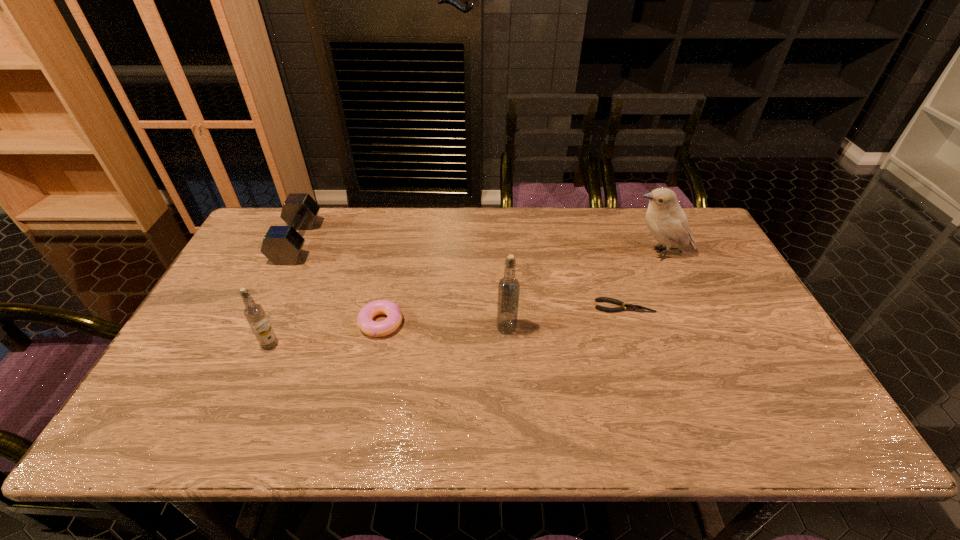
The image size is (960, 540). I want to click on free space located 0.310m on the label of the right vodka, so click(x=633, y=327).

Find the location of `free region located on the front of the dumbbell`. free region located on the front of the dumbbell is located at coordinates (247, 346).

Image resolution: width=960 pixels, height=540 pixels. Find the location of `free point located on the left of the doughnut`. free point located on the left of the doughnut is located at coordinates (300, 323).

Locate an element on the screen. This screenshot has width=960, height=540. vacant space located 0.070m at the beak of the bird is located at coordinates (604, 254).

Where is `free space located at the beak of the bird`? free space located at the beak of the bird is located at coordinates (604, 254).

Image resolution: width=960 pixels, height=540 pixels. I want to click on vacant space located 0.140m at the beak of the bird, so click(x=582, y=254).

This screenshot has width=960, height=540. What are the coordinates of `free space located 0.090m on the right of the shortest object` in the screenshot? It's located at (686, 306).

The width and height of the screenshot is (960, 540). In order to click on dumbbell present at the far edge in this screenshot , I will do `click(282, 245)`.

This screenshot has width=960, height=540. In order to click on bird at the far edge in this screenshot , I will do `click(666, 220)`.

Image resolution: width=960 pixels, height=540 pixels. Find the location of `object present at the left edge`. object present at the left edge is located at coordinates (282, 245).